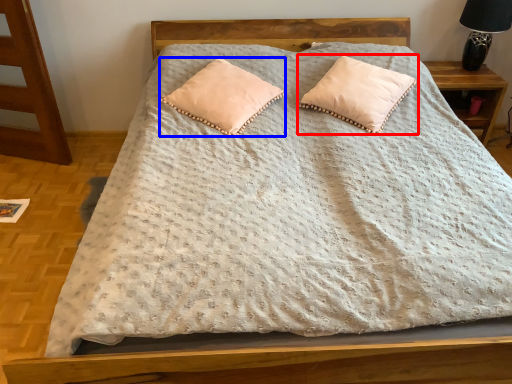
Question: Which of the following is the closest to the observer, pillow (highlighted by a red box) or pillow (highlighted by a blue box)?

Choices:
 (A) pillow
 (B) pillow

Answer: (B)